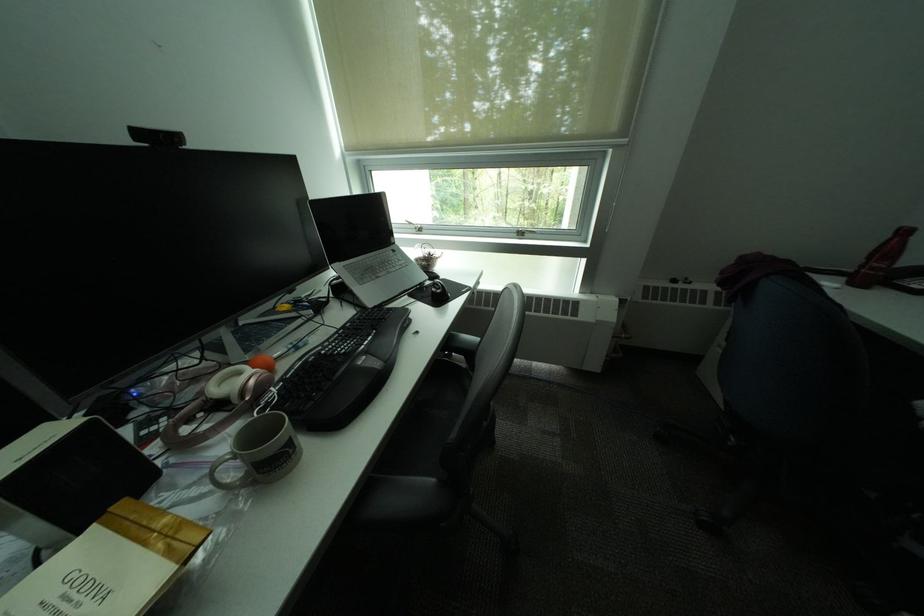
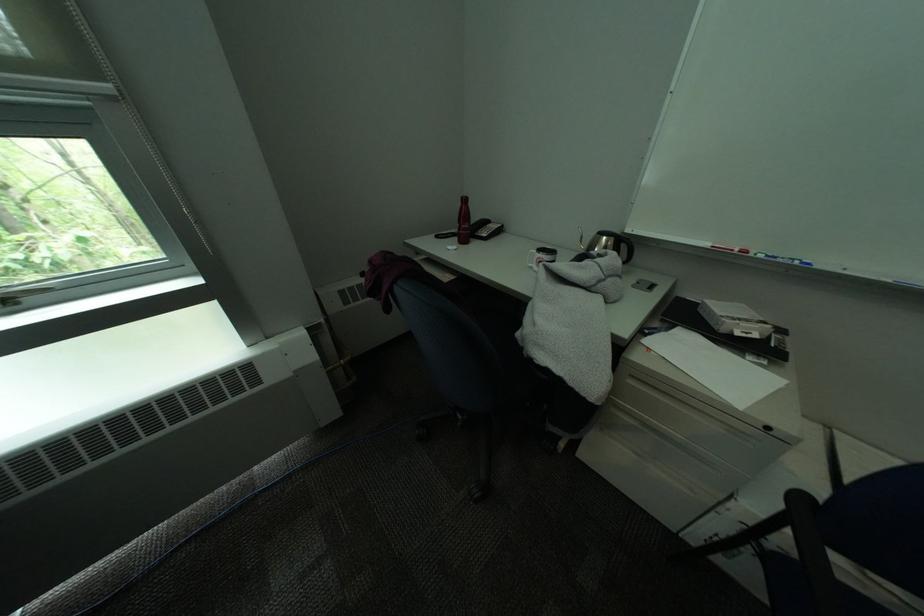
Find the pixel in the second image that matches (854,280) in the first image.

(466, 241)